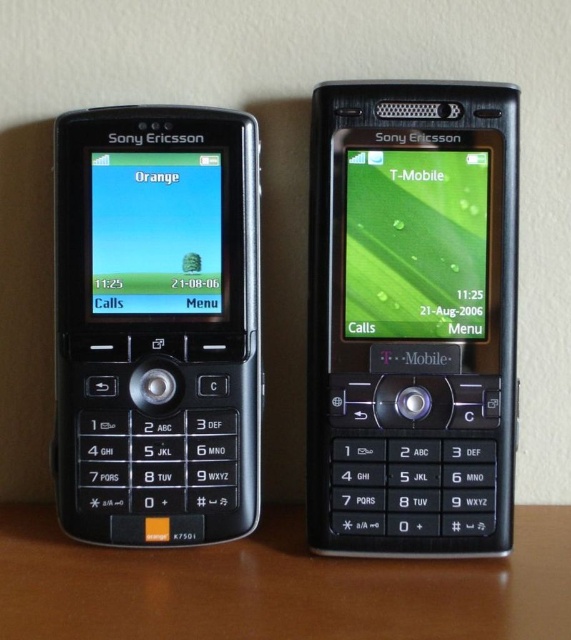
You are holding a small toy car that is 2 inches long. You want to place it on the black plastic sony ericsson at center or the black plastic keypad at lower center. Which object can accommodate the toy car without it hanging off the edge?

The black plastic sony ericsson at center is larger in size compared to the black plastic keypad at lower center, so the toy car can fit on the black plastic sony ericsson at center without hanging off the edge.

You are holding a black plastic sony ericsson at center and a black plastic keypad at lower center. Which one is closer to you?

The black plastic sony ericsson at center is closer to you than the black plastic keypad at lower center.